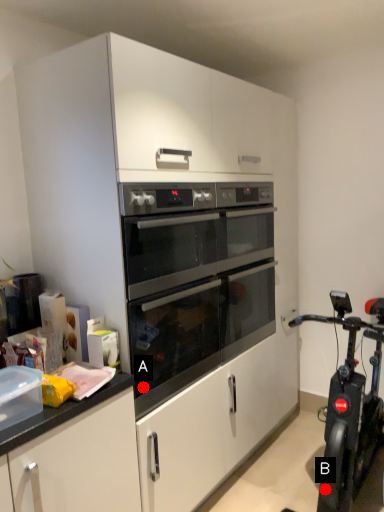
Question: Two points are circled on the image, labeled by A and B beside each circle. Which of the following is the closest to the observer?

Choices:
 (A) A is closer
 (B) B is closer

Answer: (A)